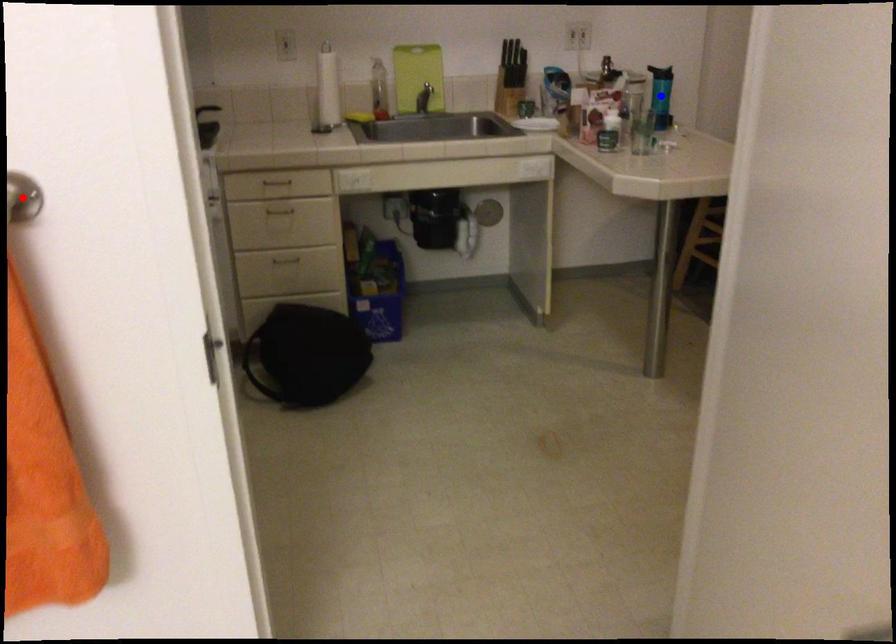
Question: Two points are marked on the image. Which point is closer to the camera?

Choices:
 (A) Blue point is closer.
 (B) Red point is closer.

Answer: (B)